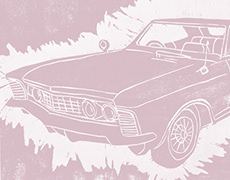
Image resolution: width=230 pixels, height=180 pixels. Find the location of `hood`. hood is located at coordinates (120, 73).